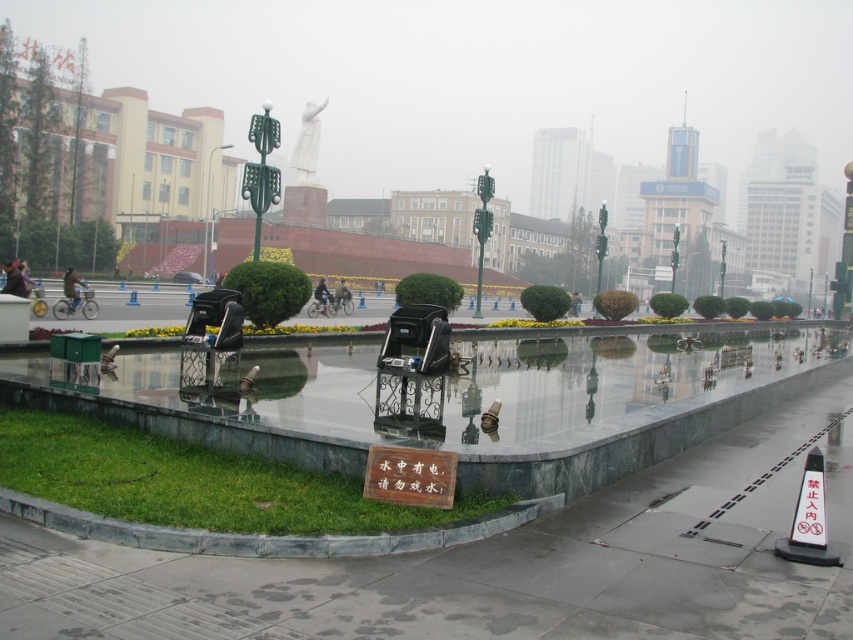
Is marble pavement at center smaller than dark gray jacket at center?

Yes.

Is marble pavement at center in front of dark gray jacket at center?

Yes, it is.

Between point (764, 547) and point (334, 300), which one is positioned in front?

Point (764, 547) is more forward.

You are a GUI agent. You are given a task and a screenshot of the screen. Output one action in this format:
    pyautogui.click(x=<x>, y=<y>)
    Task: Click on the marble pavement at center
    Image resolution: width=853 pixels, height=640 pixels.
    Given the screenshot: What is the action you would take?
    pyautogui.click(x=498, y=564)

Can you confirm if marble pavement at center is bigger than dark blue jacket at center?

No, marble pavement at center is not bigger than dark blue jacket at center.

Who is lower down, marble pavement at center or dark blue jacket at center?

Positioned lower is marble pavement at center.

Does point (431, 557) lie in front of point (320, 294)?

Yes, it is in front of point (320, 294).

Locate an element on the screen. This screenshot has height=640, width=853. marble pavement at center is located at coordinates (498, 564).

Between dark blue jacket at left and dark blue jacket at center, which one has less height?

With less height is dark blue jacket at center.

Can you confirm if dark blue jacket at left is positioned to the left of dark blue jacket at center?

Yes, dark blue jacket at left is to the left of dark blue jacket at center.

What do you see at coordinates (73, 289) in the screenshot? The width and height of the screenshot is (853, 640). I see `dark blue jacket at left` at bounding box center [73, 289].

The image size is (853, 640). In order to click on dark blue jacket at left in this screenshot , I will do `click(73, 289)`.